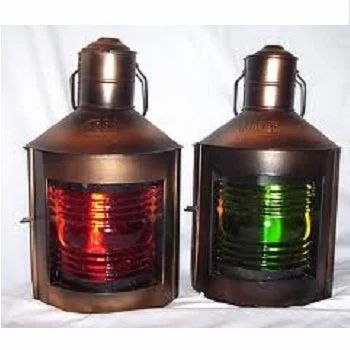
The image size is (350, 350). Identify the location of table or countertop. (211, 317).